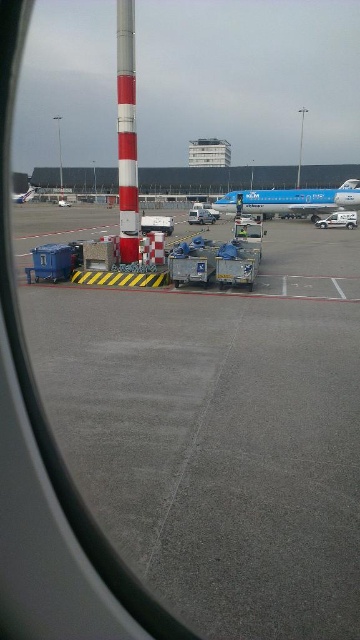
Between point (132, 10) and point (209, 220), which one is positioned in front?

Positioned in front is point (132, 10).

Does point (117, 68) come behind point (199, 209)?

No, (117, 68) is closer to viewer.

Image resolution: width=360 pixels, height=640 pixels. In order to click on red/white striped pole at left in this screenshot , I will do `click(127, 132)`.

Does blue metallic airplane at center lie behind metallic silver van at center?

That is False.

Between blue metallic airplane at center and metallic silver van at center, which one is positioned lower?

blue metallic airplane at center is lower down.

The width and height of the screenshot is (360, 640). I want to click on blue metallic airplane at center, so click(x=293, y=200).

Identify the location of blue metallic airplane at center. This screenshot has width=360, height=640. (293, 200).

Between red/white striped pole at left and metallic silver airplane at left, which one has less height?

metallic silver airplane at left

Is red/white striped pole at left to the right of metallic silver airplane at left from the viewer's perspective?

Indeed, red/white striped pole at left is positioned on the right side of metallic silver airplane at left.

The width and height of the screenshot is (360, 640). Find the location of `red/white striped pole at left`. red/white striped pole at left is located at coordinates (127, 132).

Find the location of a particular element. This screenshot has height=640, width=360. red/white striped pole at left is located at coordinates (127, 132).